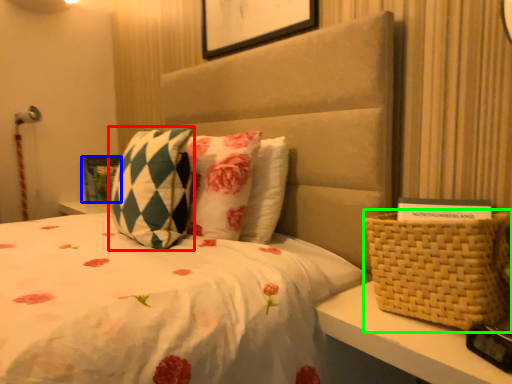
Question: Which object is the farthest from pillow (highlighted by a red box)? Choose among these: picture frame (highlighted by a blue box) or basket (highlighted by a green box).

Choices:
 (A) picture frame
 (B) basket

Answer: (A)